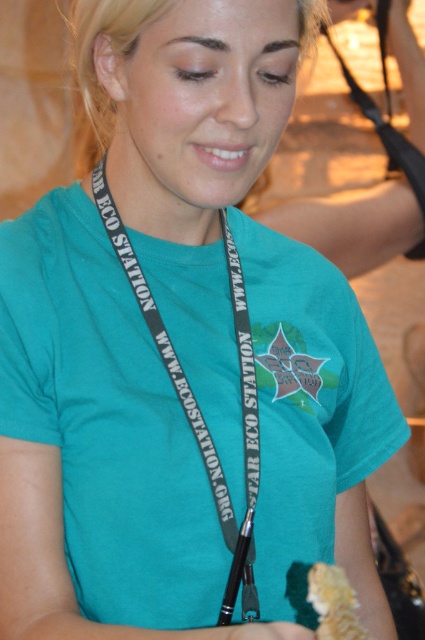
Question: Which object is the farthest from the black fabric lanyard at center?

Choices:
 (A) yellow crumbly food at lower right
 (B) black fabric strap at upper right

Answer: (B)

Question: Does black fabric lanyard at center appear over black lanyard at center?

Choices:
 (A) yes
 (B) no

Answer: (B)

Question: Is black fabric lanyard at center to the left of black fabric strap at upper right from the viewer's perspective?

Choices:
 (A) yes
 (B) no

Answer: (A)

Question: Which point is closer to the camera?

Choices:
 (A) black lanyard at center
 (B) black fabric lanyard at center

Answer: (A)

Question: Which of the following is the farthest from the observer?

Choices:
 (A) yellow crumbly food at lower right
 (B) black fabric lanyard at center

Answer: (B)

Question: From the image, what is the correct spatial relationship of black lanyard at center in relation to black fabric strap at upper right?

Choices:
 (A) below
 (B) above

Answer: (A)